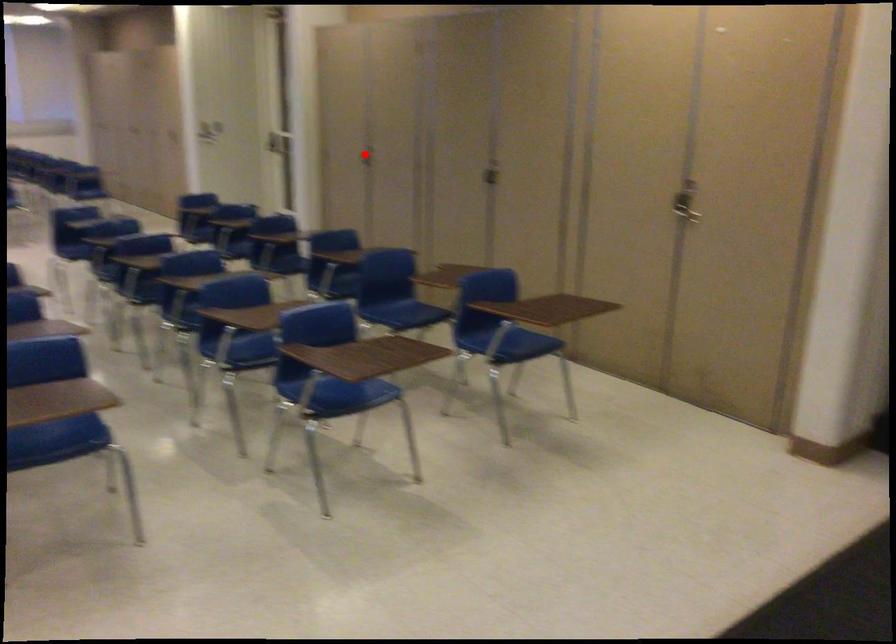
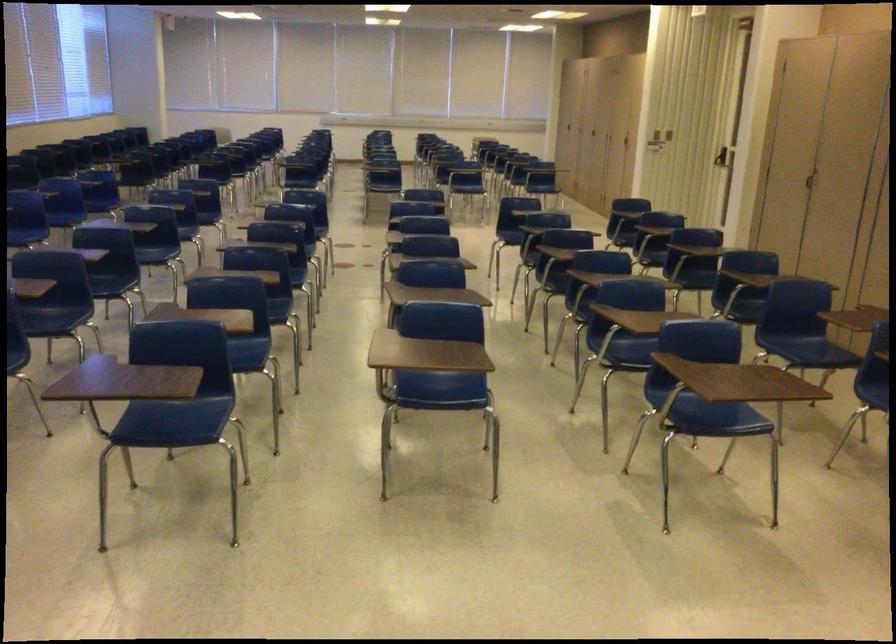
Where in the second image is the point corresponding to the highlighted location from the first image?

(808, 180)